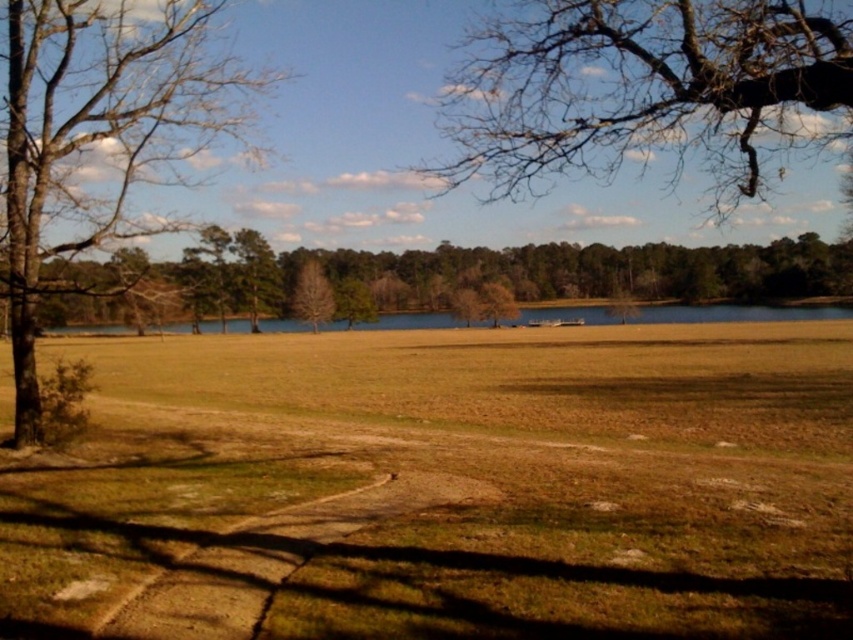
You are standing in the serene outdoor scene and want to walk towards the water. Which tree, the brown leafless tree at center or the brown matte tree at center, should you pass first?

You should pass the brown leafless tree at center first because it is closer to you than the brown matte tree at center.